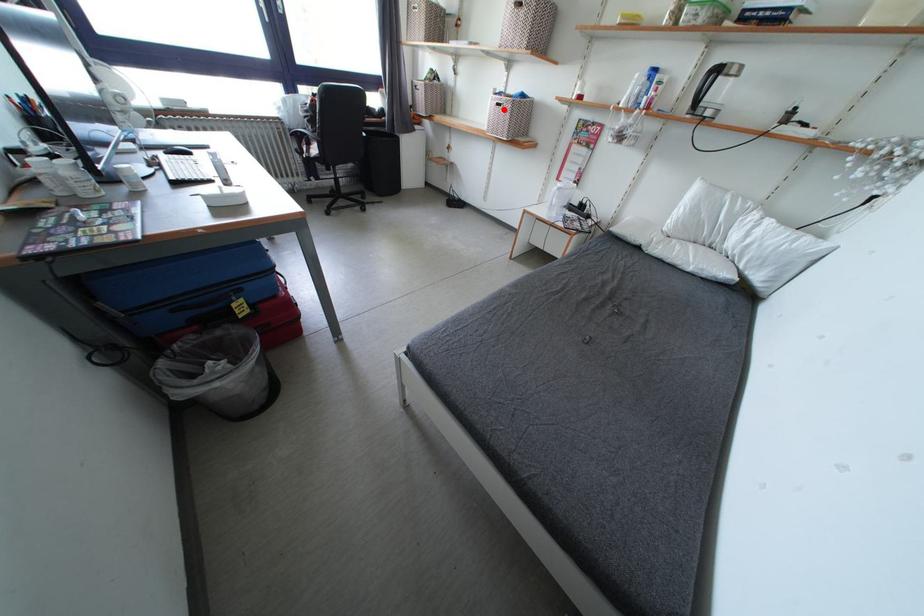
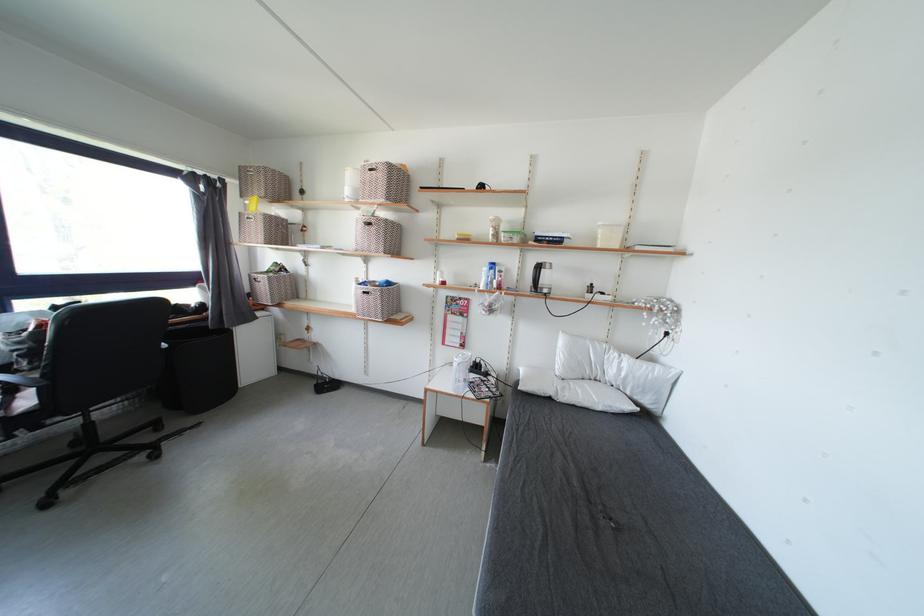
Find the pixel in the second image that matches the highlighted location in the first image.

(371, 297)